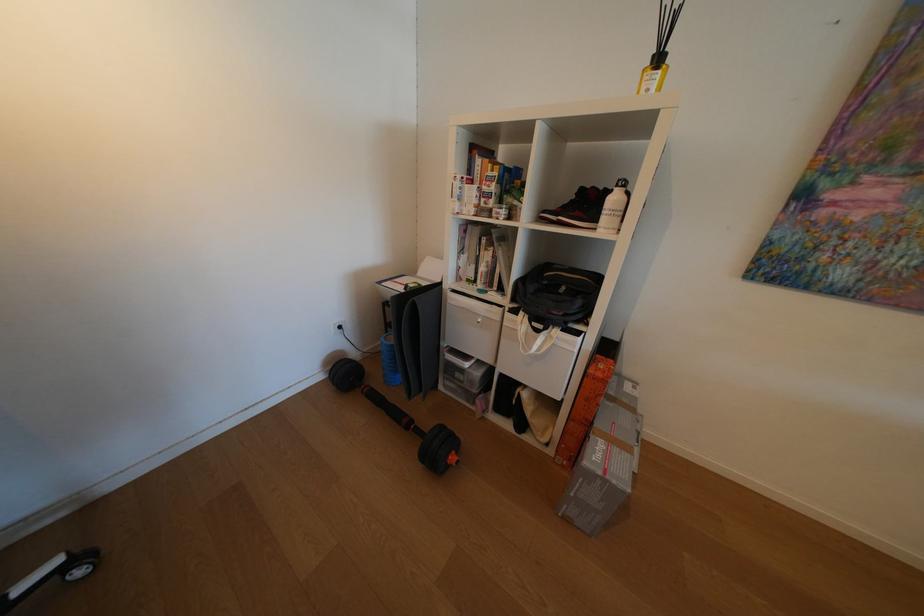
I want to click on white drawer pull, so click(x=478, y=320).